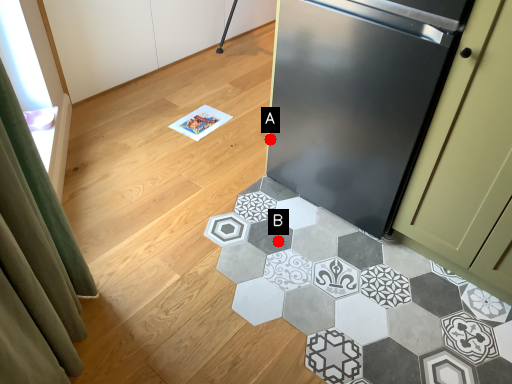
Question: Two points are circled on the image, labeled by A and B beside each circle. Which point is closer to the camera taking this photo?

Choices:
 (A) A is closer
 (B) B is closer

Answer: (B)